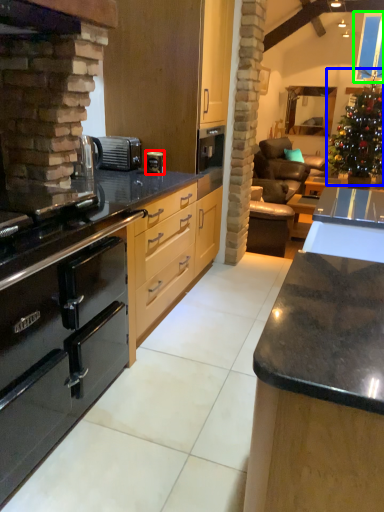
Question: Which is nearer to the coffee machine (highlighted by a red box)? christmas tree (highlighted by a blue box) or window screen (highlighted by a green box).

Choices:
 (A) christmas tree
 (B) window screen

Answer: (A)